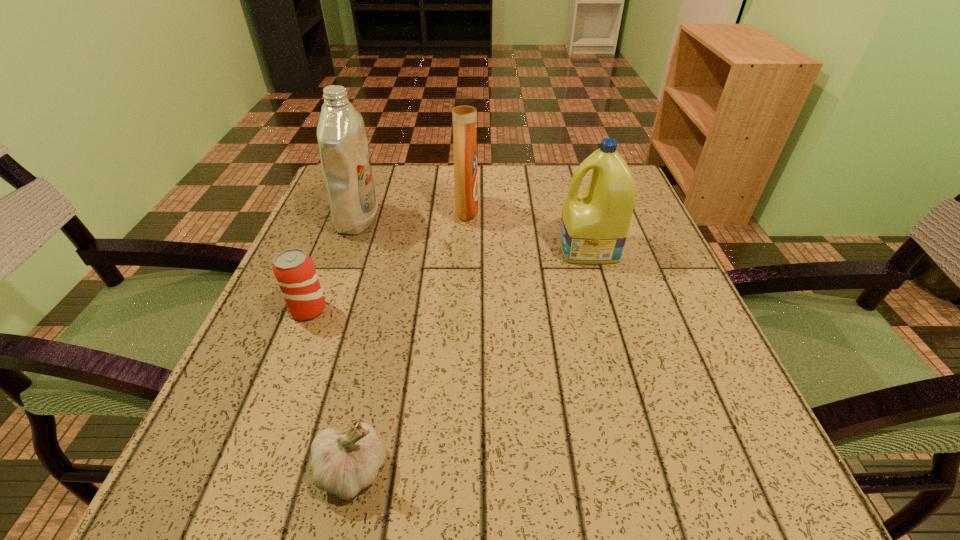
The image size is (960, 540). What are the coordinates of `the leftmost detergent` in the screenshot? It's located at (345, 159).

This screenshot has height=540, width=960. What are the coordinates of `the second object from right to left` in the screenshot? It's located at (464, 107).

What are the coordinates of `the rightmost detergent` in the screenshot? It's located at [595, 221].

The image size is (960, 540). Identify the location of the second nearest object. (294, 270).

Find the location of a particular element. the third object from left to right is located at coordinates (343, 465).

The image size is (960, 540). In order to click on garlic in this screenshot , I will do `click(343, 465)`.

You are a GUI agent. You are given a task and a screenshot of the screen. Output one action in this format:
    pyautogui.click(x=<x>, y=<y>)
    Task: Click on the vacant region located on the back of the leftmost detergent
    
    Given the screenshot: What is the action you would take?
    tap(370, 186)

The width and height of the screenshot is (960, 540). In order to click on vacant region located on the front-facing side of the second detergent from left to right in this screenshot , I will do `click(532, 210)`.

You are a GUI agent. You are given a task and a screenshot of the screen. Output one action in this format:
    pyautogui.click(x=<x>, y=<y>)
    Task: Click on the vacant region located on the label of the rightmost object
    The height and width of the screenshot is (540, 960).
    Given the screenshot: What is the action you would take?
    pyautogui.click(x=392, y=248)

Where is `free location located 0.260m on the label of the rightmost object`? The height and width of the screenshot is (540, 960). free location located 0.260m on the label of the rightmost object is located at coordinates (431, 248).